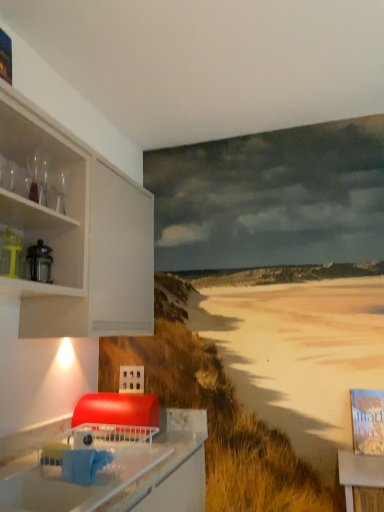
Question: Is the surface of matte yellow juicer at left in direct contact with white glossy countertop at lower left?

Choices:
 (A) no
 (B) yes

Answer: (A)

Question: Is white glossy countertop at lower left at the back of matte yellow juicer at left?

Choices:
 (A) no
 (B) yes

Answer: (A)

Question: Is matte yellow juicer at left shorter than white glossy countertop at lower left?

Choices:
 (A) no
 (B) yes

Answer: (B)

Question: From a real-world perspective, does matte yellow juicer at left sit lower than white glossy countertop at lower left?

Choices:
 (A) no
 (B) yes

Answer: (A)

Question: Can white glossy countertop at lower left be found inside matte yellow juicer at left?

Choices:
 (A) yes
 (B) no

Answer: (B)

Question: Considering the relative sizes of matte yellow juicer at left and white glossy countertop at lower left in the image provided, is matte yellow juicer at left thinner than white glossy countertop at lower left?

Choices:
 (A) yes
 (B) no

Answer: (A)

Question: Considering the relative sizes of white glossy countertop at lower left and matte yellow juicer at left in the image provided, is white glossy countertop at lower left thinner than matte yellow juicer at left?

Choices:
 (A) yes
 (B) no

Answer: (B)

Question: Is white glossy countertop at lower left positioned in front of matte yellow juicer at left?

Choices:
 (A) yes
 (B) no

Answer: (A)

Question: Considering the relative positions of white glossy countertop at lower left and matte yellow juicer at left in the image provided, is white glossy countertop at lower left to the left of matte yellow juicer at left from the viewer's perspective?

Choices:
 (A) no
 (B) yes

Answer: (A)

Question: From a real-world perspective, is white glossy countertop at lower left under matte yellow juicer at left?

Choices:
 (A) no
 (B) yes

Answer: (B)

Question: Can we say white glossy countertop at lower left lies outside matte yellow juicer at left?

Choices:
 (A) yes
 (B) no

Answer: (A)

Question: Does white glossy countertop at lower left have a greater height compared to matte yellow juicer at left?

Choices:
 (A) yes
 (B) no

Answer: (A)

Question: Considering the positions of matte yellow juicer at left and white glossy countertop at lower left in the image, is matte yellow juicer at left wider or thinner than white glossy countertop at lower left?

Choices:
 (A) thin
 (B) wide

Answer: (A)